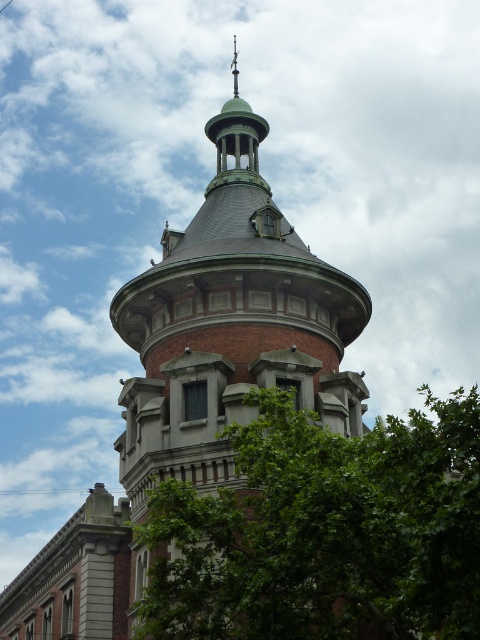
Does green leafy tree at center have a smaller size compared to red brick tower at center?

Correct, green leafy tree at center occupies less space than red brick tower at center.

Looking at this image, does green leafy tree at center appear on the left side of red brick tower at center?

No, green leafy tree at center is not to the left of red brick tower at center.

Measure the distance between green leafy tree at center and camera.

green leafy tree at center is 94.73 feet away from camera.

Locate an element on the screen. The width and height of the screenshot is (480, 640). green leafy tree at center is located at coordinates (324, 531).